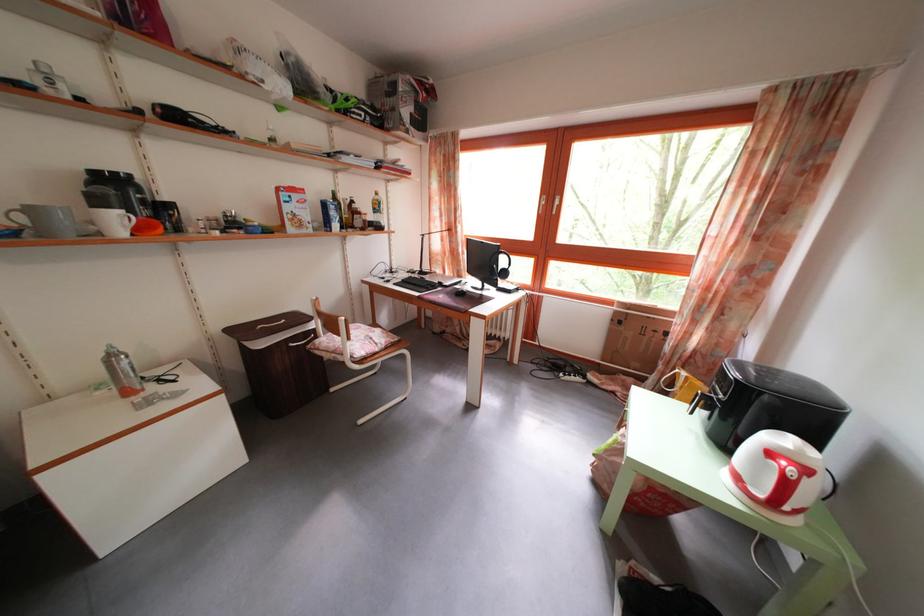
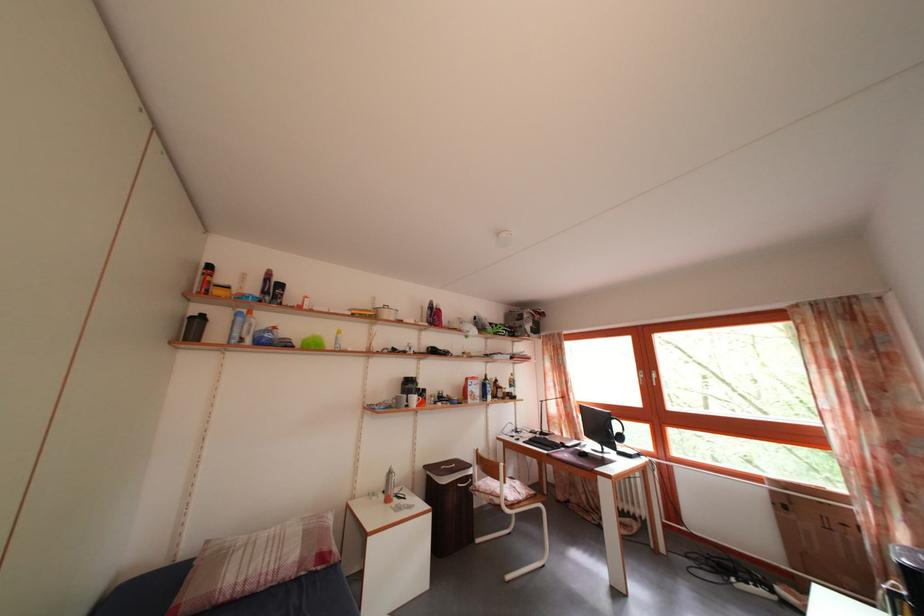
Where in the second image is the point corresponding to [429,280] from the first image?

(550, 440)